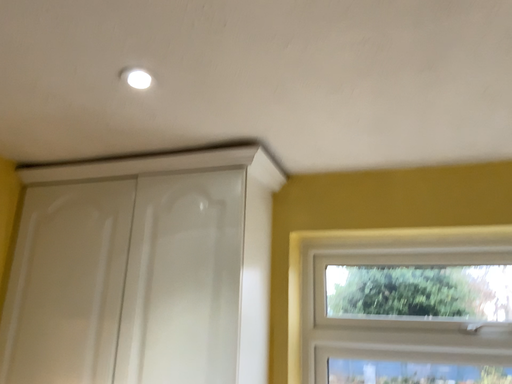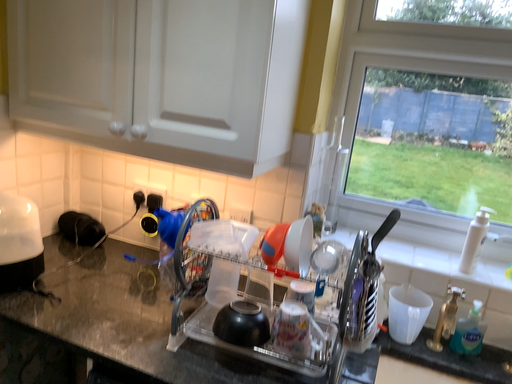
Question: How did the camera likely rotate when shooting the video?

Choices:
 (A) rotated downward
 (B) rotated upward

Answer: (A)